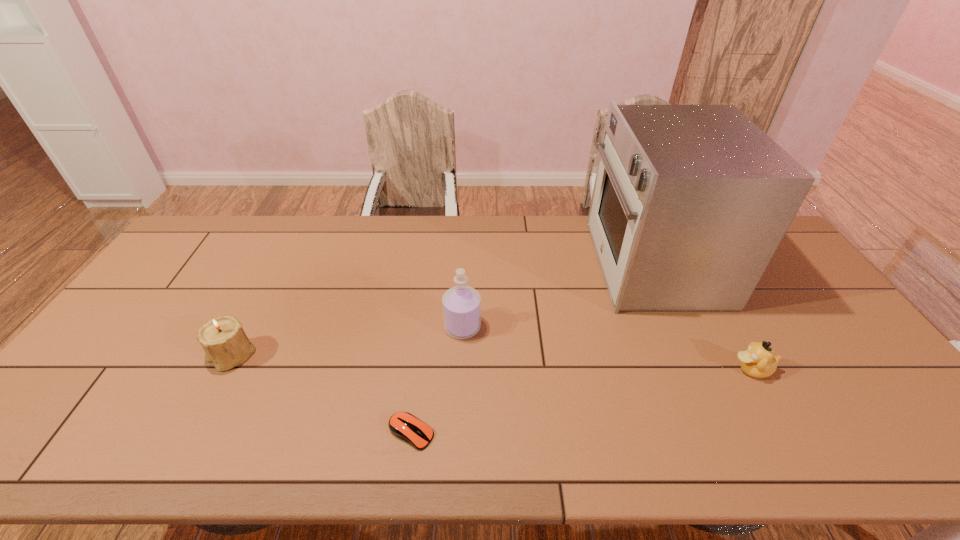
Find the location of a particular element. The image size is (960, 540). vacant point at the left edge is located at coordinates (170, 300).

At what (x,y) coordinates should I click in order to perform the action: click on vacant space at the right edge of the desktop. Please return your answer as a coordinate pair (x, y). The height and width of the screenshot is (540, 960). Looking at the image, I should click on (791, 278).

The height and width of the screenshot is (540, 960). I want to click on free space between the fourth shortest object and the leftmost object, so click(347, 341).

This screenshot has width=960, height=540. I want to click on free space between the duckling and the third shortest object, so click(x=492, y=362).

I want to click on free space between the computer mouse and the candle_holder, so click(x=322, y=394).

I want to click on vacant area between the leftmost object and the fourth tallest object, so click(492, 362).

Where is `vacant area between the candle_holder and the third object from right to left`? vacant area between the candle_holder and the third object from right to left is located at coordinates (347, 341).

Locate an element on the screen. This screenshot has height=540, width=960. free space that is in between the fourth tallest object and the candle_holder is located at coordinates (492, 362).

Where is `free space between the duckling and the tallest object`? This screenshot has height=540, width=960. free space between the duckling and the tallest object is located at coordinates (702, 316).

Image resolution: width=960 pixels, height=540 pixels. Find the location of `free space that is in between the leftmost object and the nearest object`. free space that is in between the leftmost object and the nearest object is located at coordinates (322, 394).